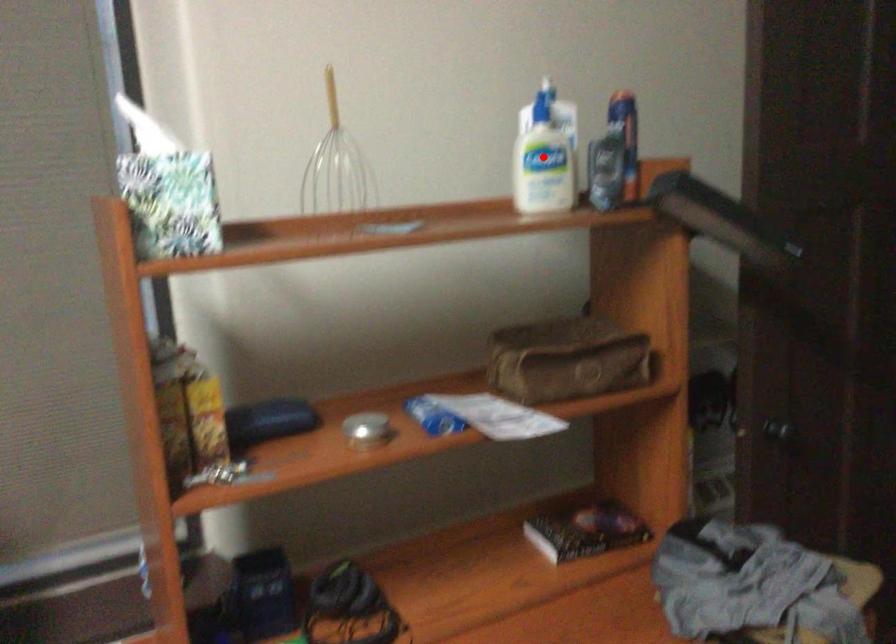
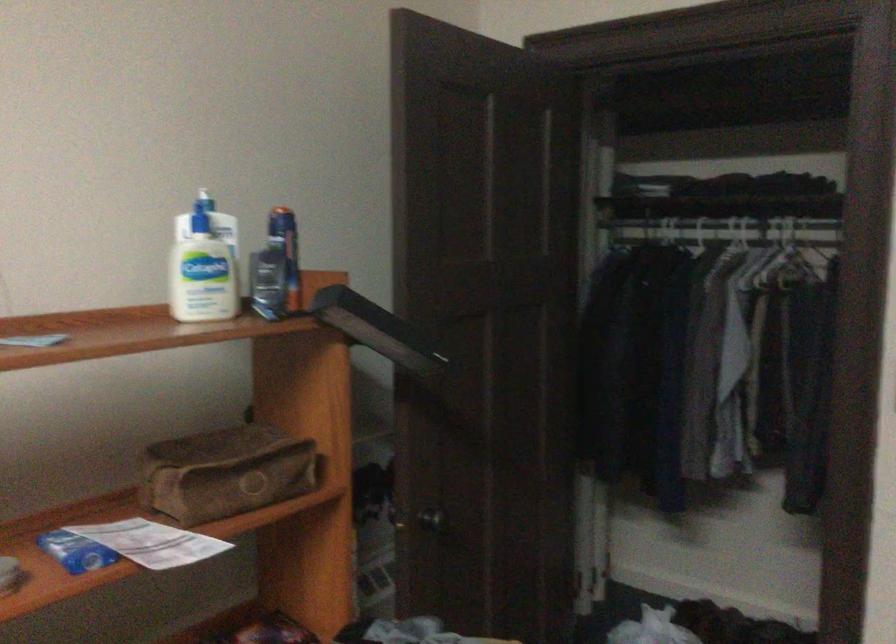
Locate, in the second image, the point that corresponds to the highlighted location in the first image.

(203, 265)